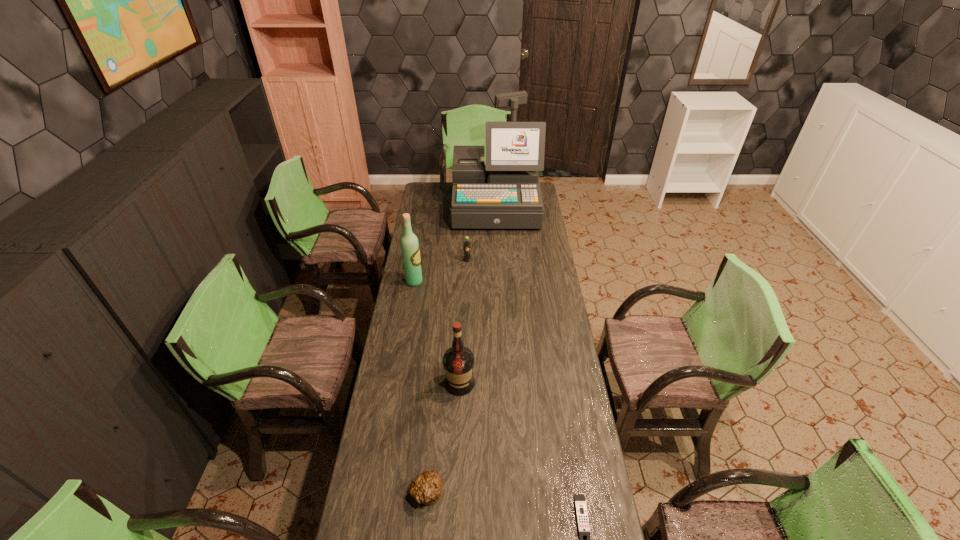
Identify the location of free spot located on the front-facing side of the third farthest object. The width and height of the screenshot is (960, 540). (478, 282).

The image size is (960, 540). In order to click on free spot located 0.090m on the surface of the third nearest object in this screenshot , I will do [458, 418].

Find the location of a particular element. Image resolution: width=960 pixels, height=540 pixels. vacant region located 0.130m on the front label of the fifth nearest object is located at coordinates (467, 280).

Find the location of a particular element. The image size is (960, 540). free space located 0.310m on the right of the second shortest object is located at coordinates 542,493.

Find the location of `object situated at the far edge`. object situated at the far edge is located at coordinates (505, 193).

Where is `wine bottle at the left edge`? This screenshot has width=960, height=540. wine bottle at the left edge is located at coordinates (409, 244).

Where is `muffin that is at the left edge`? The width and height of the screenshot is (960, 540). muffin that is at the left edge is located at coordinates (426, 488).

Identify the location of object located in the right edge section of the desktop. (505, 193).

At what (x,y) coordinates should I click in order to perform the action: click on object that is at the far right corner. Please return your answer as a coordinate pair (x, y). This screenshot has height=540, width=960. Looking at the image, I should click on (505, 193).

This screenshot has width=960, height=540. Identify the location of vacant space at the far edge of the desktop. (448, 187).